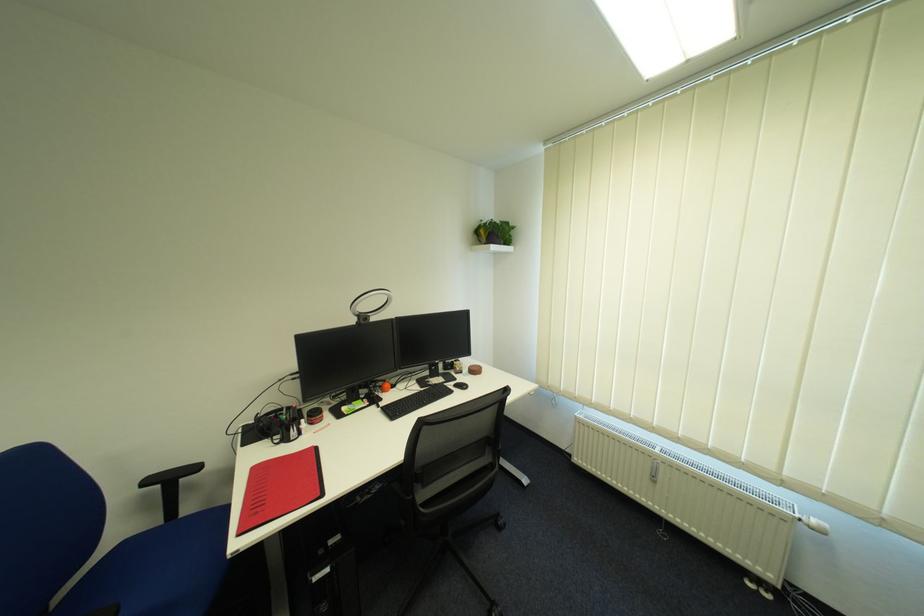
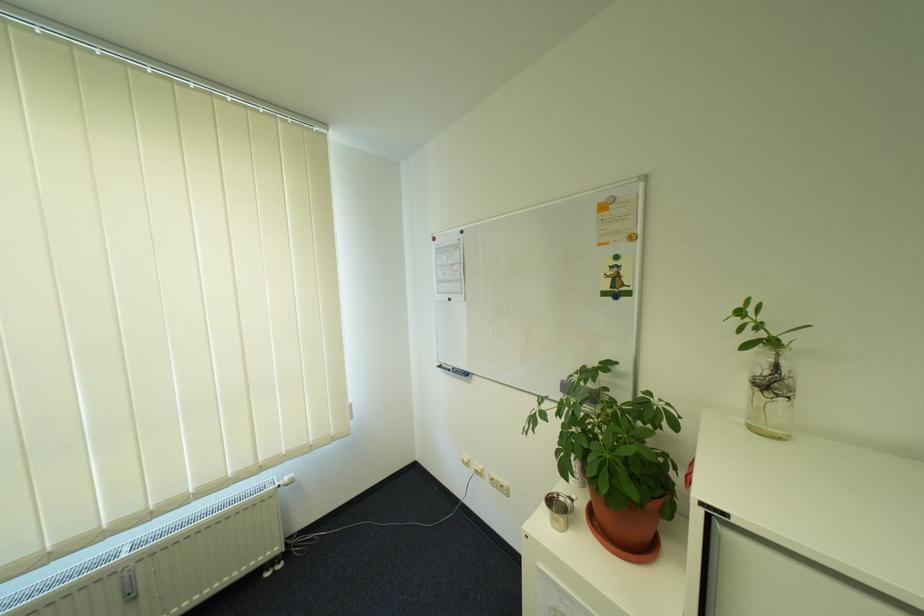
Where in the second image is the point corresponding to the point at 813,520 from the first image?

(290, 484)